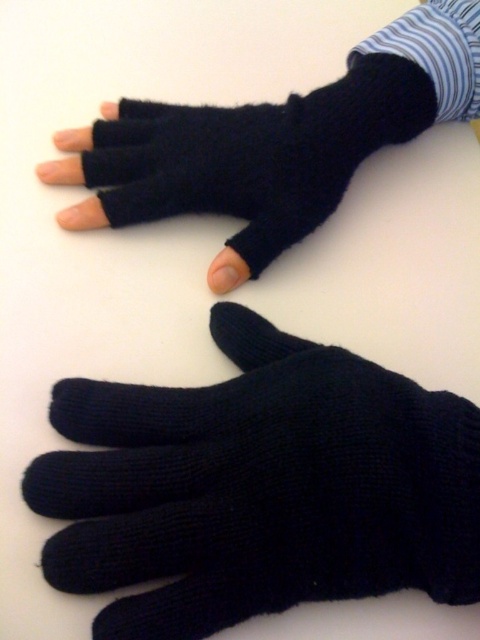
Can you confirm if black knitted glove at center is bigger than black knitted fingerless glove at upper center?

Yes, black knitted glove at center is bigger than black knitted fingerless glove at upper center.

Can you confirm if black knitted glove at center is thinner than black knitted fingerless glove at upper center?

Yes, black knitted glove at center is thinner than black knitted fingerless glove at upper center.

I want to click on black knitted glove at center, so click(259, 486).

This screenshot has width=480, height=640. Find the location of `black knitted glove at center`. black knitted glove at center is located at coordinates (259, 486).